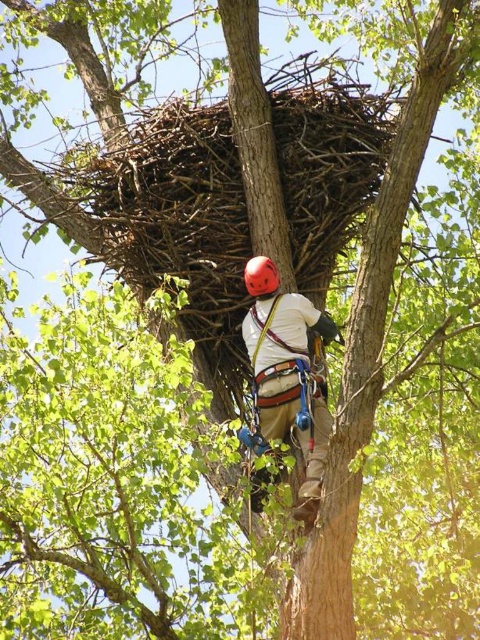
Question: Observing the image, what is the correct spatial positioning of matte white helmet at center in reference to matte red helmet at center?

Choices:
 (A) above
 (B) below

Answer: (B)

Question: Estimate the real-world distances between objects in this image. Which object is closer to the matte white helmet at center?

Choices:
 (A) white fabric safety vest at center
 (B) matte red helmet at center

Answer: (A)

Question: Which object is closer to the camera taking this photo?

Choices:
 (A) matte white helmet at center
 (B) matte red helmet at center

Answer: (A)

Question: Which point is closer to the camera?

Choices:
 (A) (267, 291)
 (B) (283, 436)
 (C) (278, 349)

Answer: (B)

Question: Is white fabric safety vest at center wider than matte red helmet at center?

Choices:
 (A) yes
 (B) no

Answer: (A)

Question: Can you confirm if matte white helmet at center is positioned to the right of white fabric safety vest at center?

Choices:
 (A) no
 (B) yes

Answer: (B)